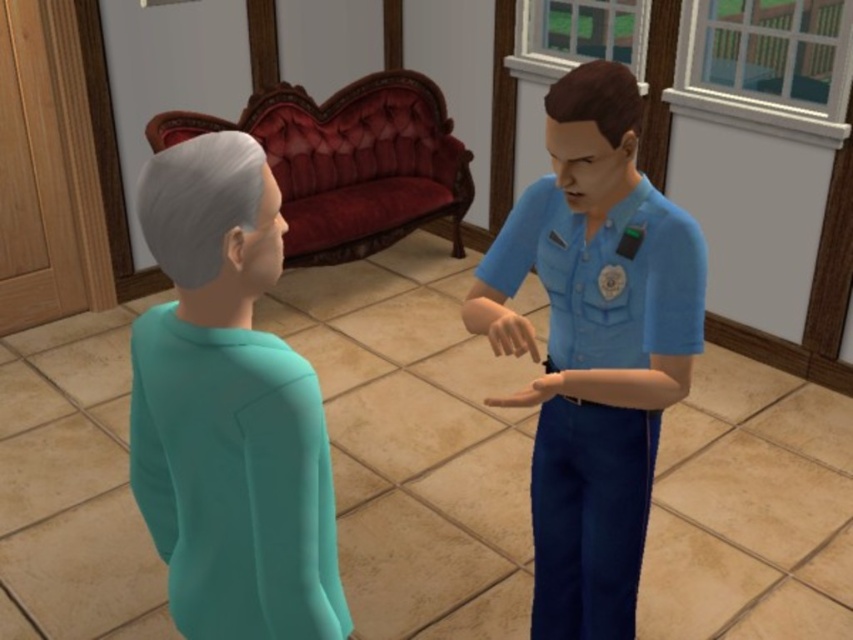
Question: Can you confirm if blue fabric uniform at right is positioned to the right of teal matte sweater at lower left?

Choices:
 (A) no
 (B) yes

Answer: (B)

Question: Which point is closer to the camera?

Choices:
 (A) (560, 221)
 (B) (193, 579)

Answer: (B)

Question: Does blue fabric uniform at right appear on the right side of teal matte sweater at lower left?

Choices:
 (A) yes
 (B) no

Answer: (A)

Question: Can you confirm if blue fabric uniform at right is positioned to the left of teal matte sweater at lower left?

Choices:
 (A) no
 (B) yes

Answer: (A)